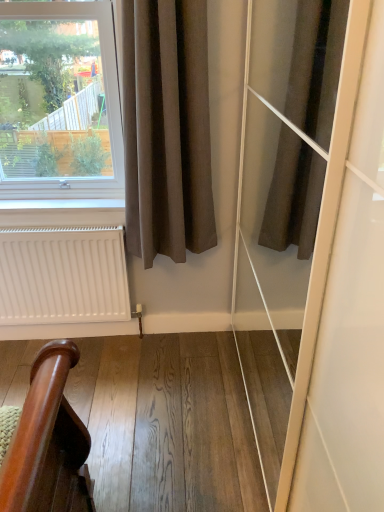
Locate an element on the screen. Image resolution: width=384 pixels, height=512 pixels. vacant space underneath white matte radiator at lower left (from a real-world perspective) is located at coordinates (92, 339).